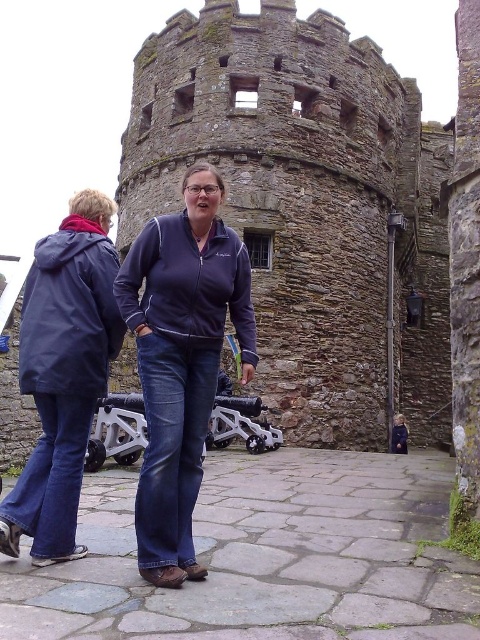
Question: Is navy blue fleece at center closer to camera compared to matte blue jacket at center?

Choices:
 (A) no
 (B) yes

Answer: (B)

Question: Among these objects, which one is farthest from the camera?

Choices:
 (A) navy blue fleece at center
 (B) matte blue jacket at center

Answer: (B)

Question: Is navy blue fleece at center in front of dark blue jeans at center?

Choices:
 (A) no
 (B) yes

Answer: (B)

Question: Considering the real-world distances, which object is farthest from the matte blue jacket at center?

Choices:
 (A) navy blue fleece at center
 (B) dark blue jeans at center

Answer: (B)

Question: Estimate the real-world distances between objects in this image. Which object is farther from the dark blue jeans at center?

Choices:
 (A) navy blue fleece at center
 (B) dark brown stone tower at center
 (C) matte blue jacket at center

Answer: (A)

Question: Is dark brown stone tower at center thinner than dark blue jeans at center?

Choices:
 (A) no
 (B) yes

Answer: (A)